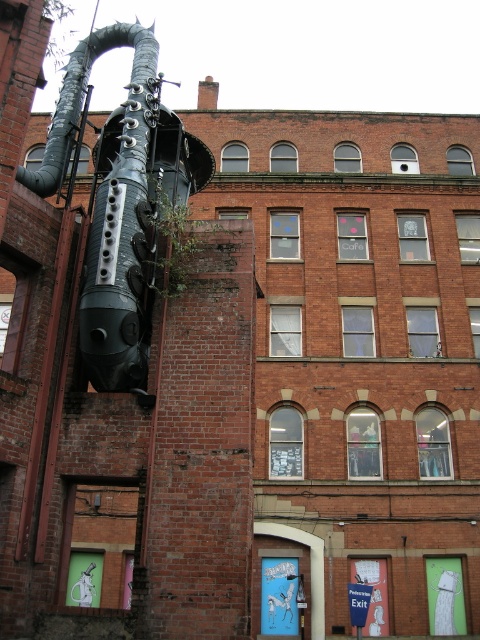
Question: Is black matte pipe at left positioned at the back of black matte pipe at upper left?

Choices:
 (A) no
 (B) yes

Answer: (B)

Question: Which of the following is the farthest from the observer?

Choices:
 (A) (98, 358)
 (B) (78, 56)

Answer: (B)

Question: Does black matte pipe at left have a lesser width compared to black matte pipe at upper left?

Choices:
 (A) no
 (B) yes

Answer: (B)

Question: Is the position of black matte pipe at left less distant than that of black matte pipe at upper left?

Choices:
 (A) yes
 (B) no

Answer: (B)